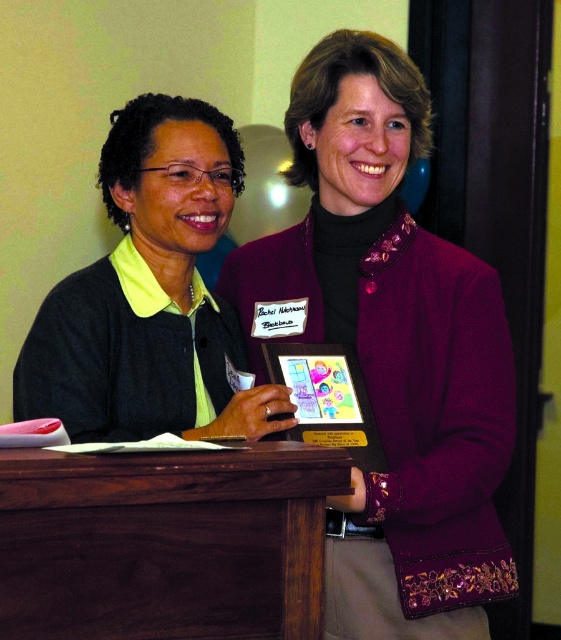
Question: Which object appears farthest from the camera in this image?

Choices:
 (A) dark brown wood table at center
 (B) matte black sweater at center

Answer: (B)

Question: Is dark brown wood table at center in front of matte black sweater at center?

Choices:
 (A) no
 (B) yes

Answer: (B)

Question: Which object is the farthest from the purple satin jacket at center?

Choices:
 (A) dark brown wood table at center
 (B) matte black sweater at center

Answer: (A)

Question: Is purple satin jacket at center in front of matte black sweater at center?

Choices:
 (A) yes
 (B) no

Answer: (B)

Question: Does dark brown wood table at center appear under matte black sweater at center?

Choices:
 (A) no
 (B) yes

Answer: (B)

Question: Estimate the real-world distances between objects in this image. Which object is closer to the matte black sweater at center?

Choices:
 (A) purple satin jacket at center
 (B) dark brown wood table at center

Answer: (A)